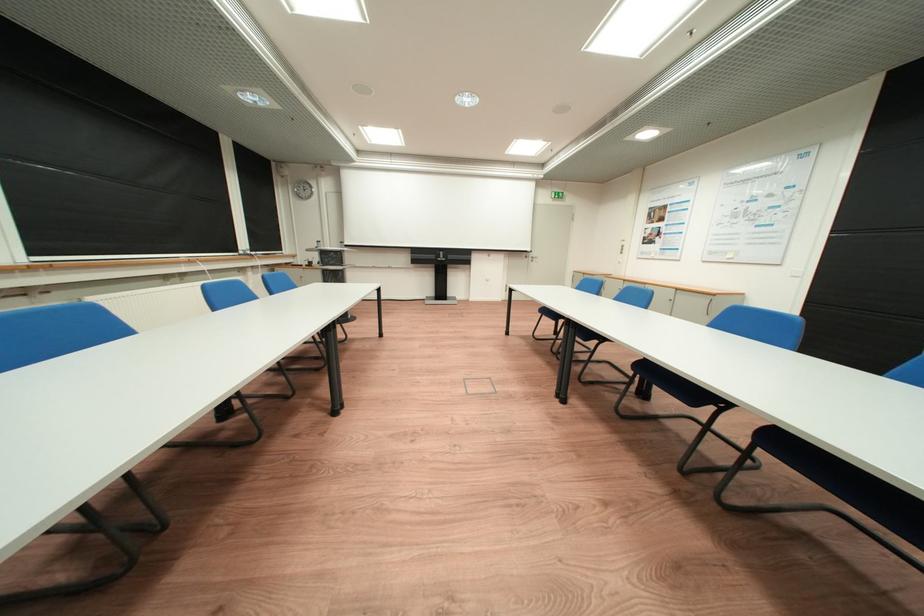
Describe the element at coordinates (441, 256) in the screenshot. I see `a projector screen handle` at that location.